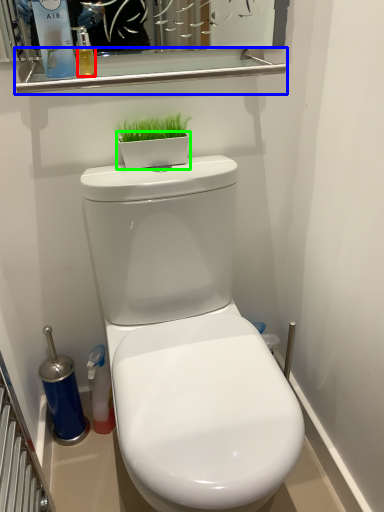
Question: Based on their relative distances, which object is nearer to liquid (highlighted by a red box)? Choose from balustrade (highlighted by a blue box) and flowerpot (highlighted by a green box).

Choices:
 (A) balustrade
 (B) flowerpot

Answer: (A)